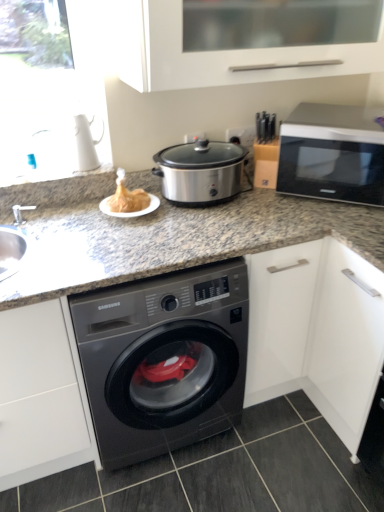
Question: Considering the positions of point (124, 413) and point (370, 181), is point (124, 413) closer or farther from the camera than point (370, 181)?

Choices:
 (A) closer
 (B) farther

Answer: (A)

Question: From the image's perspective, is black glossy washing machine at center positioned above or below silver metallic microwave at upper right?

Choices:
 (A) below
 (B) above

Answer: (A)

Question: Estimate the real-world distances between objects in this image. Which object is closer to the golden crispy turkey at center?

Choices:
 (A) granite gray countertop at center
 (B) black glossy washing machine at center
 (C) dark gray tile at lower center
 (D) silver metallic microwave at upper right
 (E) stainless steel slow cooker at center

Answer: (E)

Question: Which of these objects is positioned farthest from the silver metallic microwave at upper right?

Choices:
 (A) dark gray tile at lower center
 (B) white matte cabinet at upper center
 (C) black glossy washing machine at center
 (D) stainless steel slow cooker at center
 (E) granite gray countertop at center

Answer: (A)